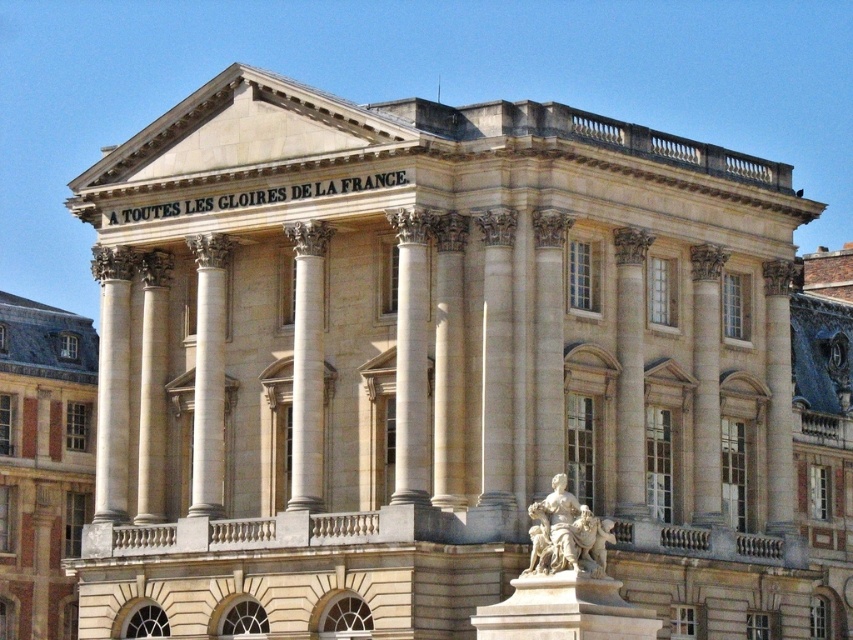
Question: Does beige stone building at left have a lesser width compared to white marble statue at lower center?

Choices:
 (A) yes
 (B) no

Answer: (B)

Question: Does beige stone building at left appear on the left side of white marble statue at lower center?

Choices:
 (A) no
 (B) yes

Answer: (B)

Question: Can you confirm if beige stone building at left is thinner than white marble statue at lower center?

Choices:
 (A) yes
 (B) no

Answer: (B)

Question: Which of the following is the closest to the observer?

Choices:
 (A) (55, 627)
 (B) (590, 552)

Answer: (B)